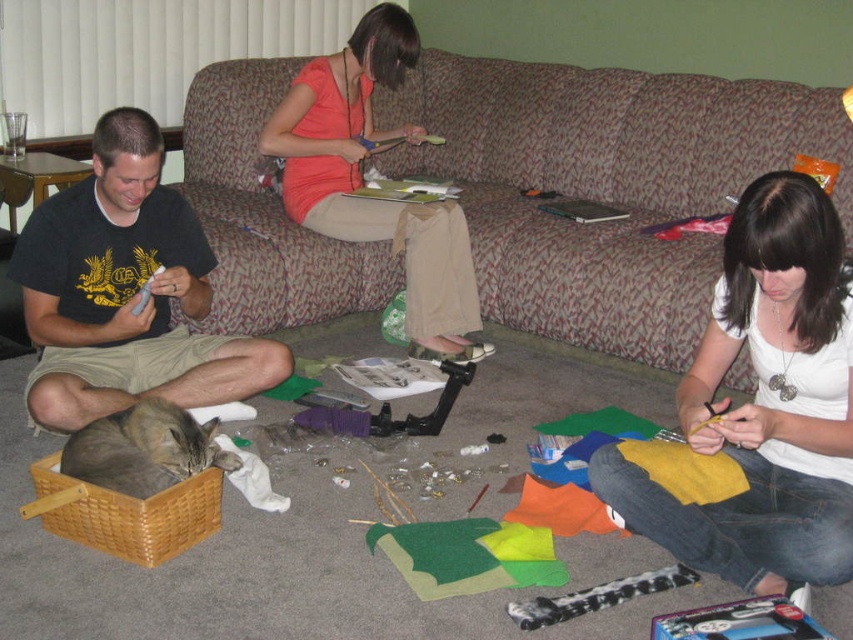
You are organizing a craft fair and need to display the white fabric at lower right and the orange cotton shirt at center. Which item requires more space to display?

The orange cotton shirt at center requires more space to display because the white fabric at lower right occupies less space than it.